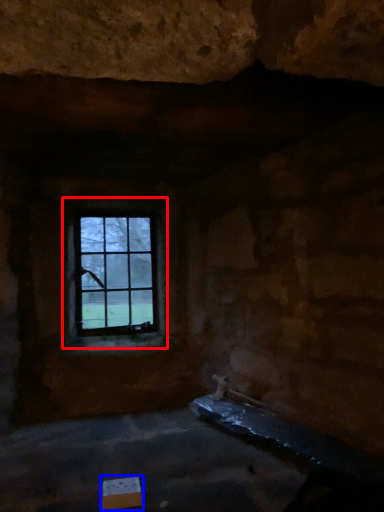
Question: Which point is closer to the camera, window (highlighted by a red box) or cardboard box (highlighted by a blue box)?

Choices:
 (A) window
 (B) cardboard box

Answer: (B)